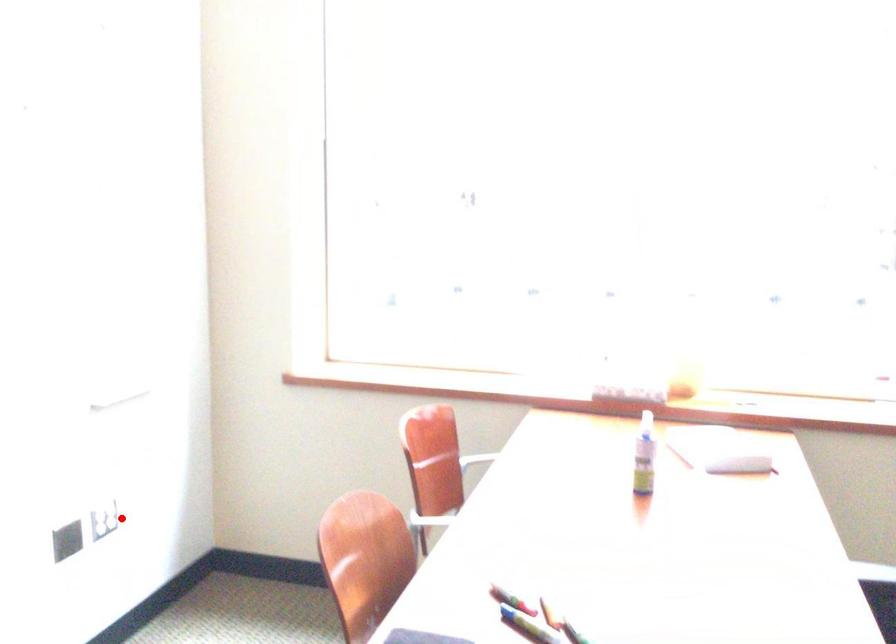
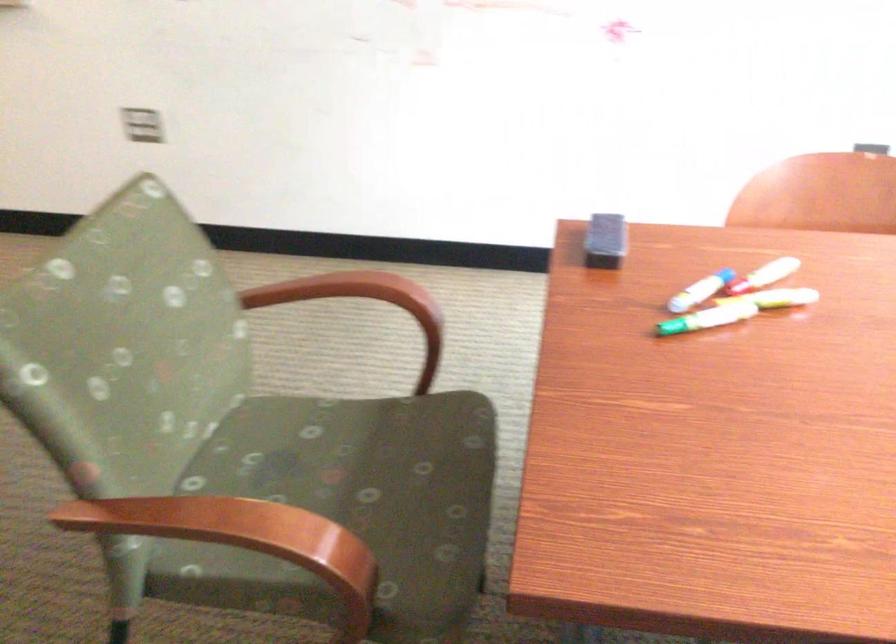
The point at the highlighted location is marked in the first image. Where is the corresponding point in the second image?

(871, 147)